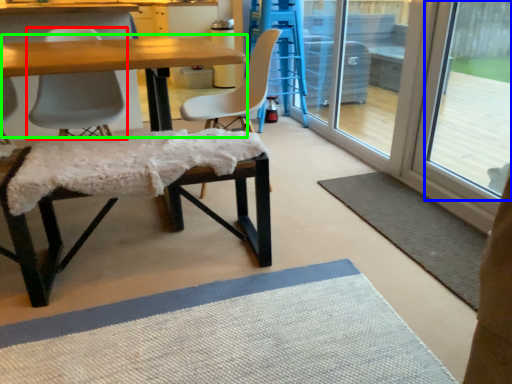
Question: Considering the real-world distances, which object is farthest from chair (highlighted by a red box)? window screen (highlighted by a blue box) or table (highlighted by a green box)?

Choices:
 (A) window screen
 (B) table

Answer: (A)